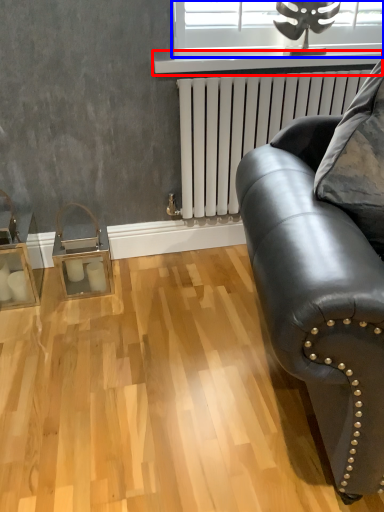
Question: Which object is closer to the camera taking this photo, window sill (highlighted by a red box) or window (highlighted by a blue box)?

Choices:
 (A) window sill
 (B) window

Answer: (A)